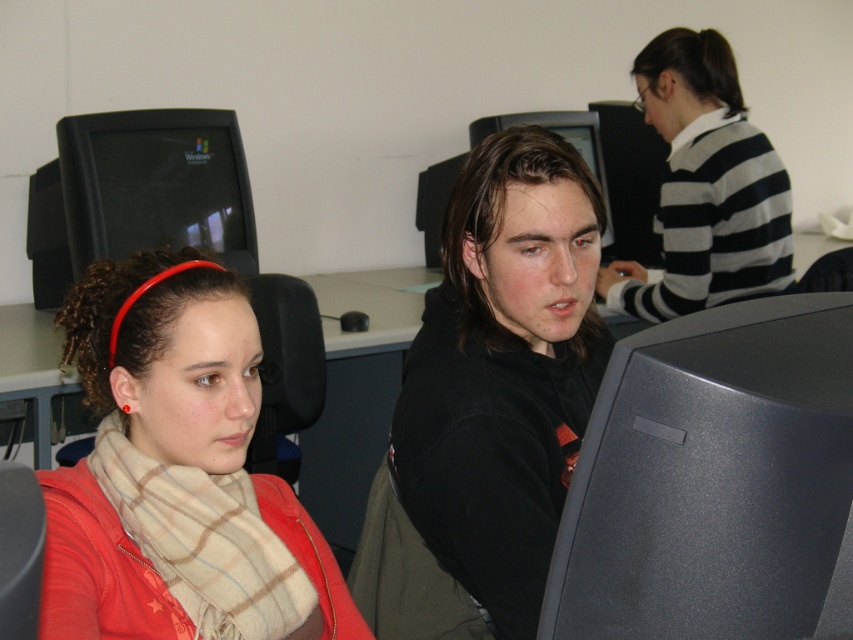
Can you confirm if black matte jacket at center is thinner than black matte monitor at upper left?

Yes.

This screenshot has height=640, width=853. Find the location of `black matte jacket at center`. black matte jacket at center is located at coordinates (503, 371).

Does matte black monitor at center have a smaller size compared to black matte jacket at center?

Indeed, matte black monitor at center has a smaller size compared to black matte jacket at center.

Is matte black monitor at center shorter than black matte jacket at center?

Correct, matte black monitor at center is not as tall as black matte jacket at center.

Does point (811, 564) lie in front of point (547, 374)?

Yes, it is.

The height and width of the screenshot is (640, 853). I want to click on matte black monitor at center, so click(x=711, y=477).

Does point (741, 176) come behind point (171, 195)?

Yes, it is behind point (171, 195).

Is striped sweater at upper right below black matte monitor at upper left?

Actually, striped sweater at upper right is above black matte monitor at upper left.

The image size is (853, 640). What do you see at coordinates (704, 186) in the screenshot? I see `striped sweater at upper right` at bounding box center [704, 186].

Where is `striped sweater at upper right`? This screenshot has height=640, width=853. striped sweater at upper right is located at coordinates (704, 186).